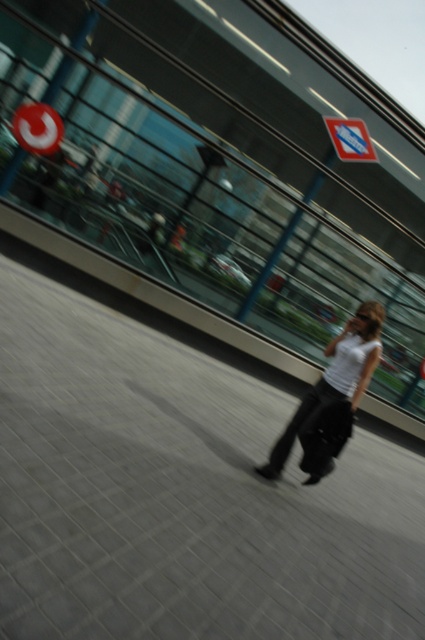
Question: Considering the relative positions of white matte shirt at center and matte red circle at upper left in the image provided, where is white matte shirt at center located with respect to matte red circle at upper left?

Choices:
 (A) below
 (B) above

Answer: (A)

Question: Which of the following is the closest to the observer?

Choices:
 (A) matte red circle at upper left
 (B) white matte shirt at center

Answer: (B)

Question: Among these points, which one is nearest to the camera?

Choices:
 (A) (350, 157)
 (B) (263, 465)
 (C) (181, 557)

Answer: (C)

Question: Does white matte shirt at center have a greater width compared to matte red circle at upper left?

Choices:
 (A) no
 (B) yes

Answer: (B)

Question: Which of the following is the closest to the observer?

Choices:
 (A) (272, 467)
 (B) (121, 541)
 (C) (59, 124)
 (D) (333, 116)

Answer: (B)

Question: Where is gray concrete pavement at center located in relation to blue reflective sign at upper center in the image?

Choices:
 (A) right
 (B) left

Answer: (B)